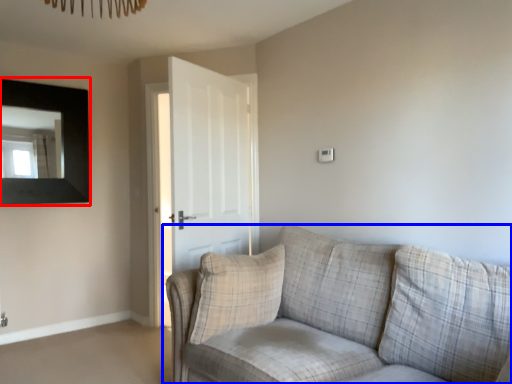
Question: Among these objects, which one is nearest to the camera, picture frame (highlighted by a red box) or studio couch (highlighted by a blue box)?

Choices:
 (A) picture frame
 (B) studio couch

Answer: (B)